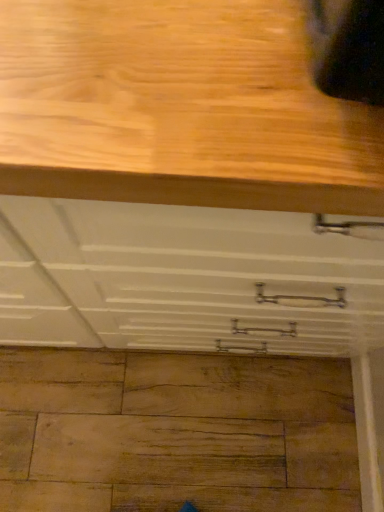
What do you see at coordinates (179, 108) in the screenshot? I see `wooden countertop at upper center` at bounding box center [179, 108].

The height and width of the screenshot is (512, 384). Identify the location of wooden countertop at upper center. (179, 108).

Identify the location of wooden countertop at upper center. The width and height of the screenshot is (384, 512). (179, 108).